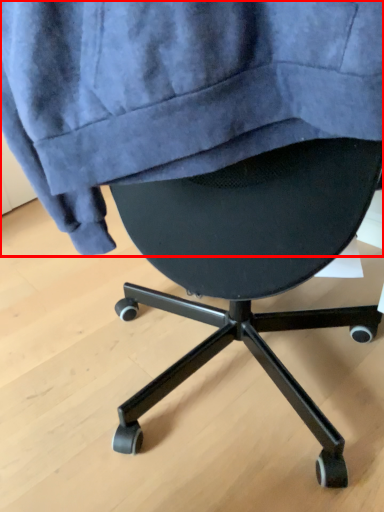
Question: From the image's perspective, where is sweatshirt (annotated by the red box) located in relation to chair in the image?

Choices:
 (A) below
 (B) above

Answer: (B)